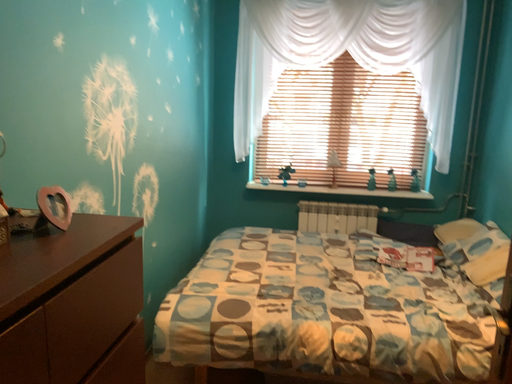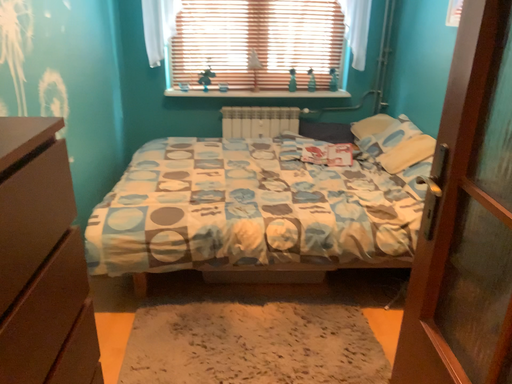
Question: How did the camera likely rotate when shooting the video?

Choices:
 (A) rotated upward
 (B) rotated downward

Answer: (B)